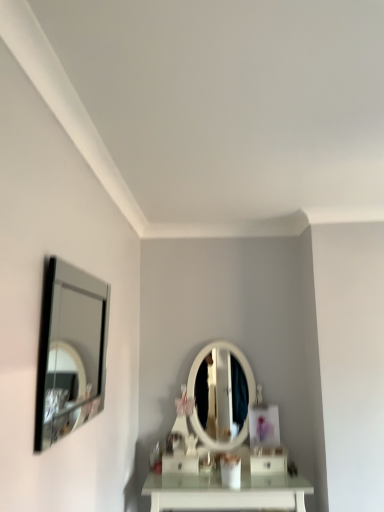
Image resolution: width=384 pixels, height=512 pixels. I want to click on vacant space situated above white glossy drawer at lower center, which ranks as the second drawer in left-to-right order (from a real-world perspective), so click(264, 452).